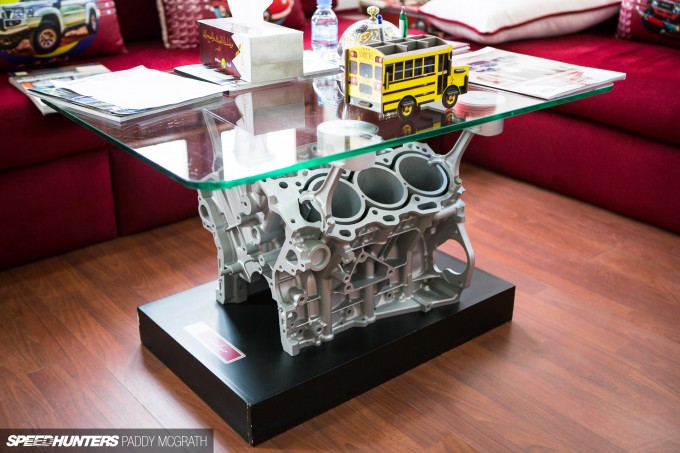
You are a GUI agent. You are given a task and a screenshot of the screen. Output one action in this format:
    pyautogui.click(x=<x>, y=<y>)
    Task: Click on the glass
    This screenshot has width=680, height=453.
    Given the screenshot: What is the action you would take?
    pyautogui.click(x=279, y=104)